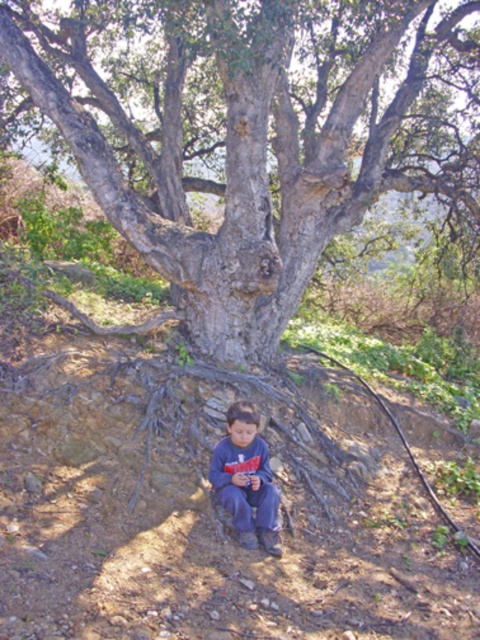
In order to click on gray rough bark tree at center in this screenshot , I will do (x=252, y=131).

Is the position of gray rough bark tree at center less distant than that of dark blue jeans at lower center?

That is False.

Who is more forward, (x=434, y=134) or (x=278, y=545)?

Point (x=278, y=545) is more forward.

Where is `gray rough bark tree at center`? The width and height of the screenshot is (480, 640). gray rough bark tree at center is located at coordinates (252, 131).